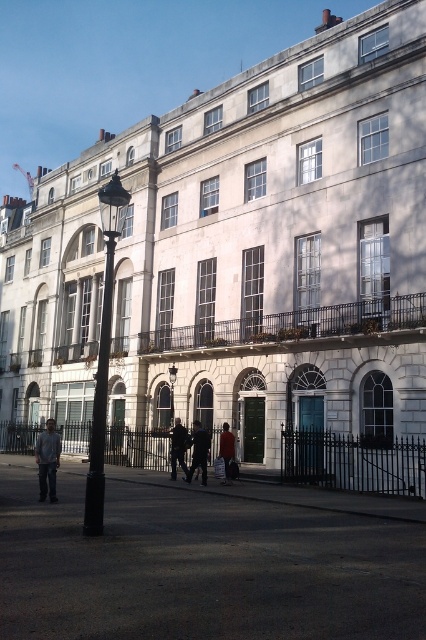
Question: Does black metal streetlight at left appear under black glass lamp post at center?

Choices:
 (A) no
 (B) yes

Answer: (A)

Question: Which object is positioned farthest from the denim jacket at lower left?

Choices:
 (A) dark asphalt pavement at lower center
 (B) black glass lamp post at center
 (C) red fabric bag at center
 (D) dark gray jacket at center

Answer: (B)

Question: Does dark asphalt pavement at lower center have a smaller size compared to black metal streetlight at left?

Choices:
 (A) no
 (B) yes

Answer: (B)

Question: Which point is farther to the camera?

Choices:
 (A) (114, 225)
 (B) (230, 477)
 (C) (368, 586)
 (D) (40, 468)

Answer: (A)

Question: Is denim jacket at lower left further to the viewer compared to dark gray suit at center?

Choices:
 (A) no
 (B) yes

Answer: (A)

Question: Which point appears closest to the camera in this image?

Choices:
 (A) (169, 406)
 (B) (224, 452)

Answer: (B)